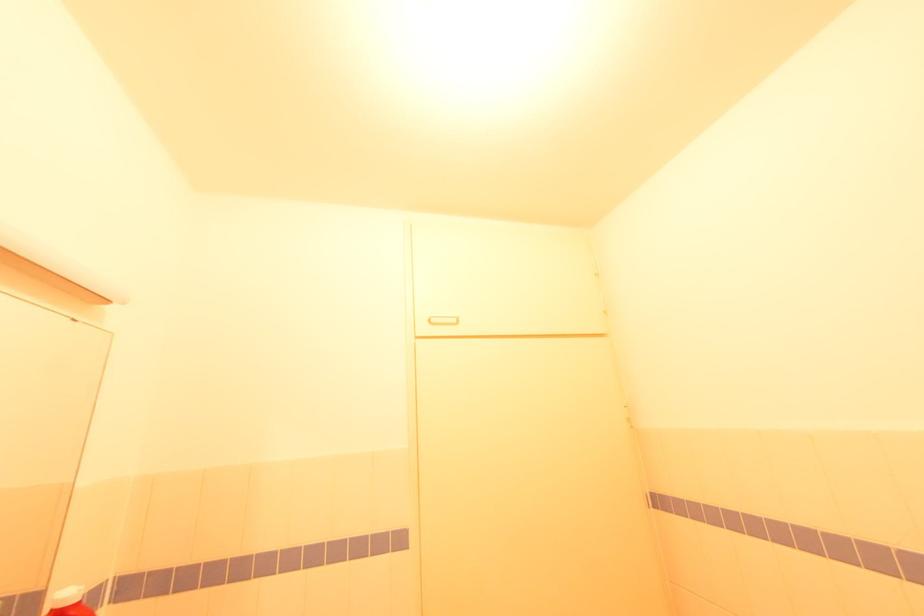
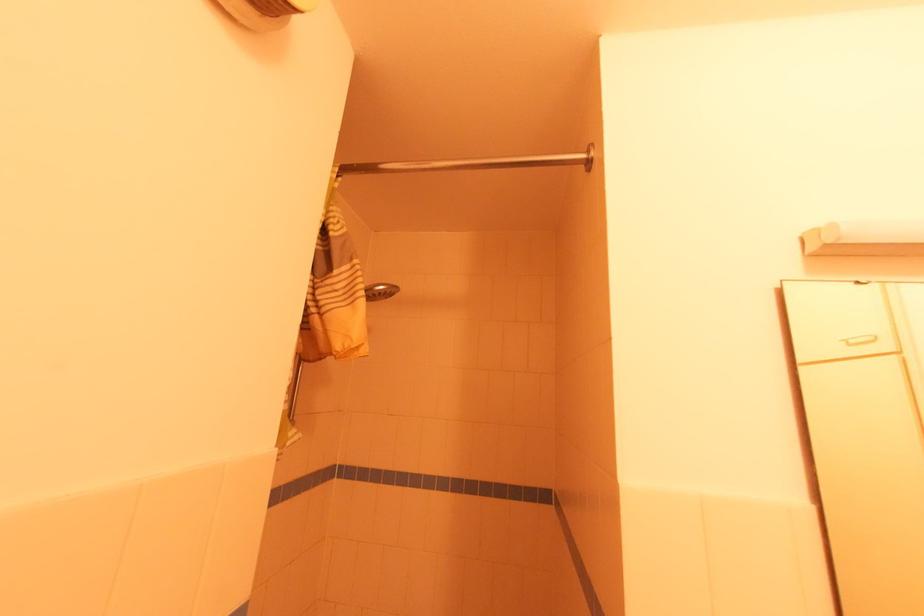
How did the camera likely rotate?

The camera rotated toward left-up.